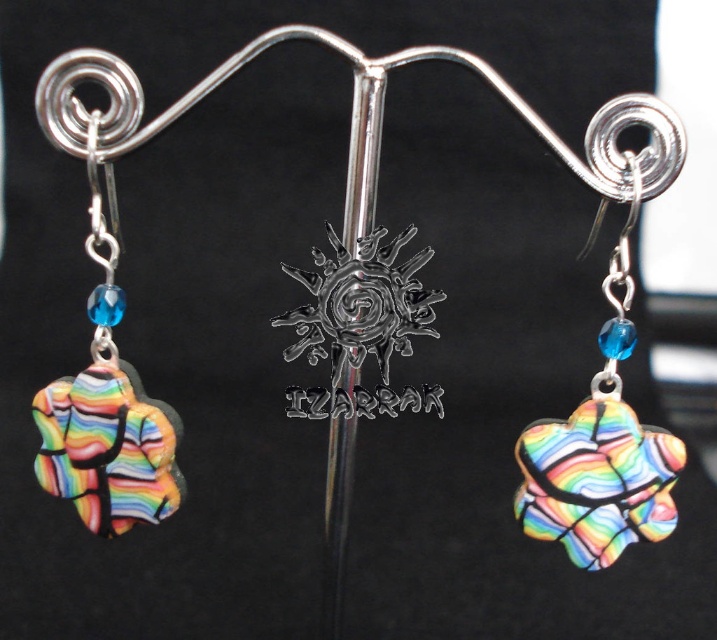
Question: Which object is farther from the camera taking this photo?

Choices:
 (A) rainbow glass heart at center
 (B) rainbow glass flower at left

Answer: (B)

Question: Observing the image, what is the correct spatial positioning of rainbow glass heart at center in reference to rainbow glass flower at left?

Choices:
 (A) above
 (B) below

Answer: (B)

Question: Which point is closer to the camera?

Choices:
 (A) (607, 108)
 (B) (104, 81)

Answer: (A)

Question: In this image, where is rainbow glass heart at center located relative to rainbow glass flower at left?

Choices:
 (A) right
 (B) left

Answer: (A)

Question: Is rainbow glass heart at center in front of rainbow glass flower at left?

Choices:
 (A) no
 (B) yes

Answer: (B)

Question: Which object is closer to the camera taking this photo?

Choices:
 (A) rainbow glass heart at center
 (B) rainbow glass flower at left

Answer: (A)